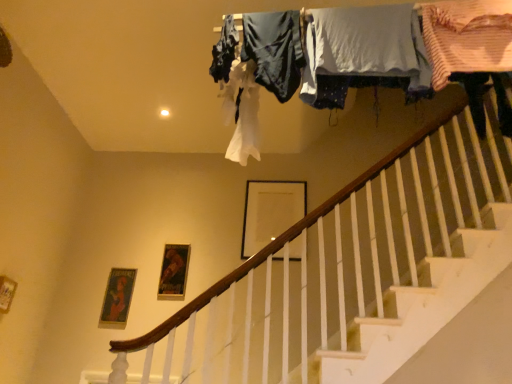
Question: From a real-world perspective, is white cotton shirt at upper center, the 2th clothing viewed from the right, located higher than dark blue fabric at upper center, the 4th clothing viewed from the right?

Choices:
 (A) yes
 (B) no

Answer: (B)

Question: Is dark blue fabric at upper center, the first clothing in the left-to-right sequence, at the back of white cotton shirt at upper center, which appears as the third clothing when viewed from the left?

Choices:
 (A) no
 (B) yes

Answer: (A)

Question: Is white cotton shirt at upper center, which appears as the third clothing when viewed from the left, wider than dark blue fabric at upper center, the 4th clothing viewed from the right?

Choices:
 (A) no
 (B) yes

Answer: (B)

Question: Is white cotton shirt at upper center, which appears as the third clothing when viewed from the left, in contact with dark blue fabric at upper center, the first clothing in the left-to-right sequence?

Choices:
 (A) no
 (B) yes

Answer: (A)

Question: Does white cotton shirt at upper center, which appears as the third clothing when viewed from the left, come behind dark blue fabric at upper center, the 4th clothing viewed from the right?

Choices:
 (A) no
 (B) yes

Answer: (A)

Question: From the image's perspective, is white cotton shirt at upper center, which appears as the third clothing when viewed from the left, positioned above or below matte white picture frame at center, the first picture frame positioned from the right?

Choices:
 (A) above
 (B) below

Answer: (A)

Question: Is white cotton shirt at upper center, which appears as the third clothing when viewed from the left, situated inside matte white picture frame at center, positioned as the 1th picture frame in top-to-bottom order, or outside?

Choices:
 (A) outside
 (B) inside

Answer: (A)

Question: Considering the positions of white cotton shirt at upper center, which appears as the third clothing when viewed from the left, and matte white picture frame at center, the second picture frame viewed from the left, in the image, is white cotton shirt at upper center, which appears as the third clothing when viewed from the left, bigger or smaller than matte white picture frame at center, the second picture frame viewed from the left,?

Choices:
 (A) small
 (B) big

Answer: (B)

Question: From a real-world perspective, is white cotton shirt at upper center, which appears as the third clothing when viewed from the left, positioned above or below matte white picture frame at center, the second picture frame viewed from the left?

Choices:
 (A) below
 (B) above

Answer: (A)

Question: Which is correct: metallic gold picture frame at center, placed as the 2th picture frame when sorted from right to left, is inside dark blue fabric at upper center, the first clothing in the left-to-right sequence, or outside of it?

Choices:
 (A) inside
 (B) outside

Answer: (B)

Question: In terms of height, does metallic gold picture frame at center, placed as the 2th picture frame when sorted from right to left, look taller or shorter compared to dark blue fabric at upper center, the first clothing in the left-to-right sequence?

Choices:
 (A) tall
 (B) short

Answer: (A)

Question: Considering their positions, is metallic gold picture frame at center, the first picture frame in the left-to-right sequence, located in front of or behind dark blue fabric at upper center, the 4th clothing viewed from the right?

Choices:
 (A) front
 (B) behind

Answer: (B)

Question: Is point (167, 249) positioned closer to the camera than point (208, 69)?

Choices:
 (A) farther
 (B) closer

Answer: (A)

Question: Considering the positions of white cotton shirt at upper center, which appears as the third clothing when viewed from the left, and dark blue fabric at upper center, the first clothing in the left-to-right sequence, in the image, is white cotton shirt at upper center, which appears as the third clothing when viewed from the left, wider or thinner than dark blue fabric at upper center, the first clothing in the left-to-right sequence,?

Choices:
 (A) thin
 (B) wide

Answer: (B)

Question: In terms of height, does white cotton shirt at upper center, the 2th clothing viewed from the right, look taller or shorter compared to dark blue fabric at upper center, the 4th clothing viewed from the right?

Choices:
 (A) tall
 (B) short

Answer: (A)